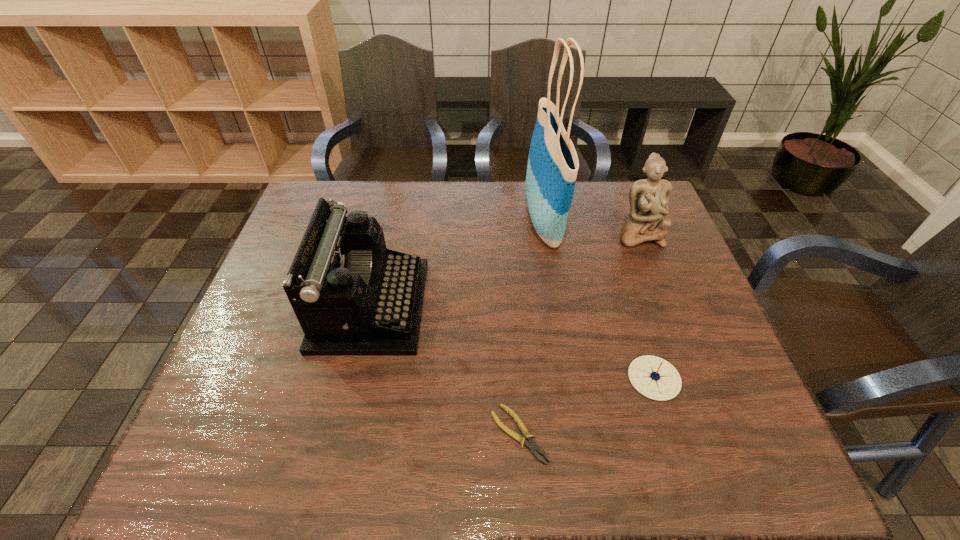
Find the location of `vacant space located on the typing side of the leftmost object`. vacant space located on the typing side of the leftmost object is located at coordinates (552, 306).

Identify the location of vacant region located on the left of the second nearest object. (562, 378).

The width and height of the screenshot is (960, 540). What are the coordinates of `free space located on the right of the shortest object` in the screenshot? It's located at (631, 434).

Locate an element on the screen. The height and width of the screenshot is (540, 960). tote bag that is at the far edge is located at coordinates (553, 164).

This screenshot has height=540, width=960. I want to click on figurine that is positioned at the far edge, so click(649, 198).

Locate an element on the screen. The image size is (960, 540). object that is at the near edge is located at coordinates (532, 445).

This screenshot has width=960, height=540. In order to click on object that is at the left edge in this screenshot , I will do `click(354, 296)`.

The height and width of the screenshot is (540, 960). Identify the location of figurine that is at the right edge. (649, 198).

The width and height of the screenshot is (960, 540). I want to click on compass that is at the right edge, so click(x=653, y=377).

Identify the location of object that is positioned at the far right corner. This screenshot has width=960, height=540. point(649,198).